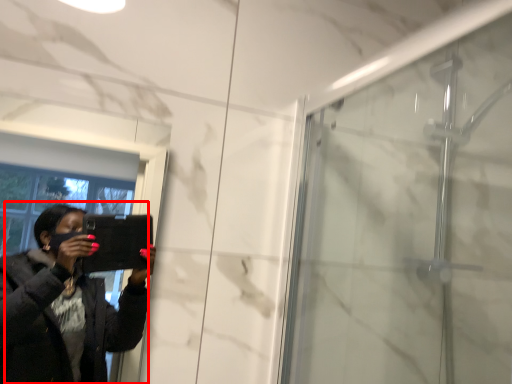
Question: Considering the relative positions of woman (annotated by the red box) and screen door in the image provided, where is woman (annotated by the red box) located with respect to the staircase?

Choices:
 (A) left
 (B) right

Answer: (A)